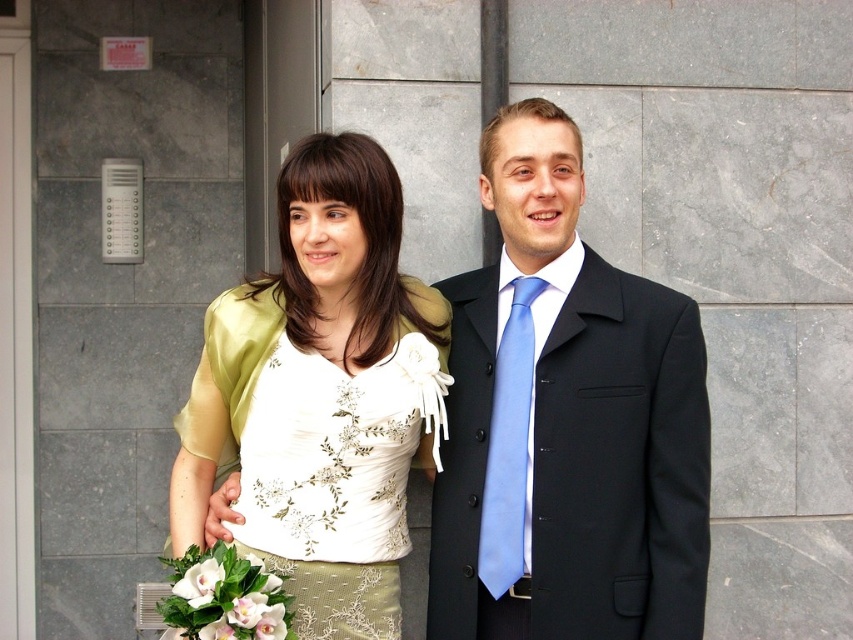
Question: Does matte gold blouse at center appear over white satin dress at center?

Choices:
 (A) yes
 (B) no

Answer: (A)

Question: Which object appears farthest from the camera in this image?

Choices:
 (A) light blue satin tie at center
 (B) white satin dress at center

Answer: (A)

Question: Which point is closer to the camera?

Choices:
 (A) black woolen suit at center
 (B) matte gold blouse at center
 (C) light blue satin tie at center

Answer: (A)

Question: Which object appears farthest from the camera in this image?

Choices:
 (A) black woolen suit at center
 (B) matte gold blouse at center
 (C) matte black suit at center
 (D) light blue satin tie at center

Answer: (D)

Question: Is black woolen suit at center smaller than light blue satin tie at center?

Choices:
 (A) yes
 (B) no

Answer: (B)

Question: Can you confirm if black woolen suit at center is bigger than light blue satin tie at center?

Choices:
 (A) yes
 (B) no

Answer: (A)